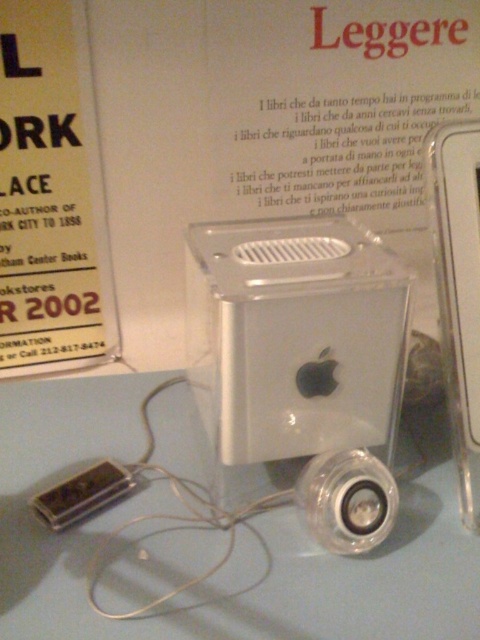
Between white plastic table at center and satin silver computer at center, which one has less height?

Standing shorter between the two is white plastic table at center.

Is point (46, 456) positioned in front of point (310, 378)?

That is False.

Between point (59, 465) and point (235, 244), which one is positioned behind?

The point (59, 465) is behind.

At what (x,y) coordinates should I click in order to perform the action: click on white plastic table at center. Please return your answer as a coordinate pair (x, y). Image resolution: width=480 pixels, height=640 pixels. Looking at the image, I should click on (252, 522).